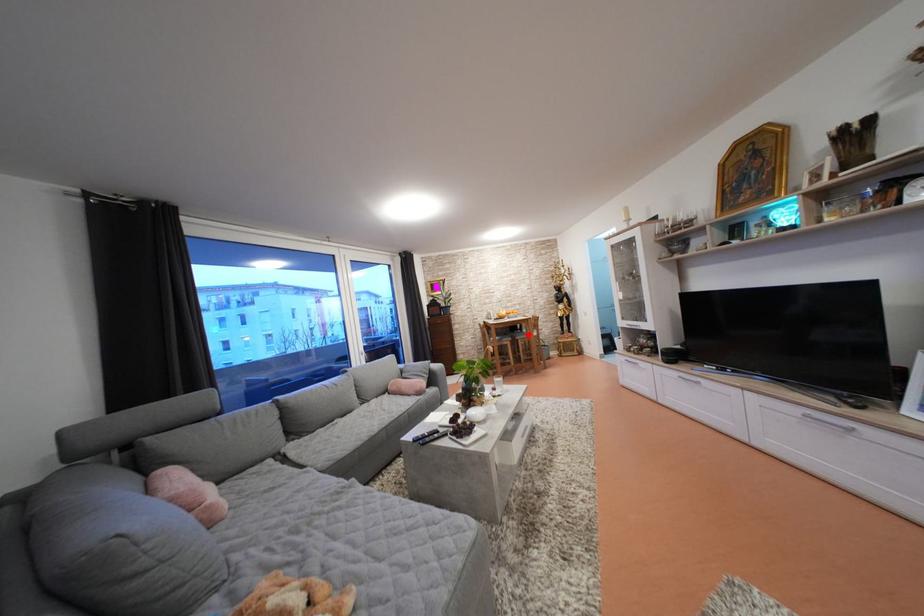
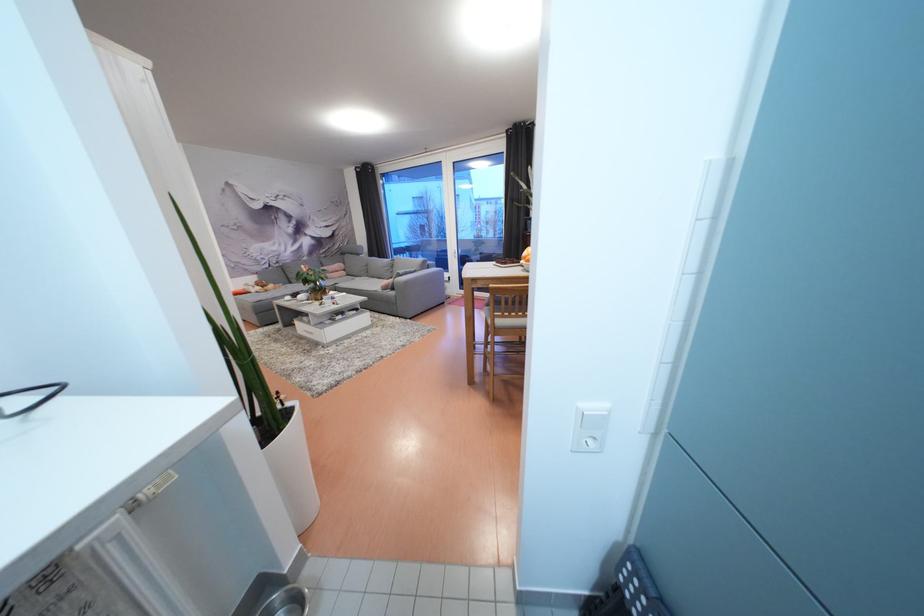
Question: I am providing you with two images of the same scene from different viewpoints. A red point is marked on the first image. At the location where the point appears in image 1, is it still visible in image 2?

Choices:
 (A) Yes
 (B) No

Answer: (B)